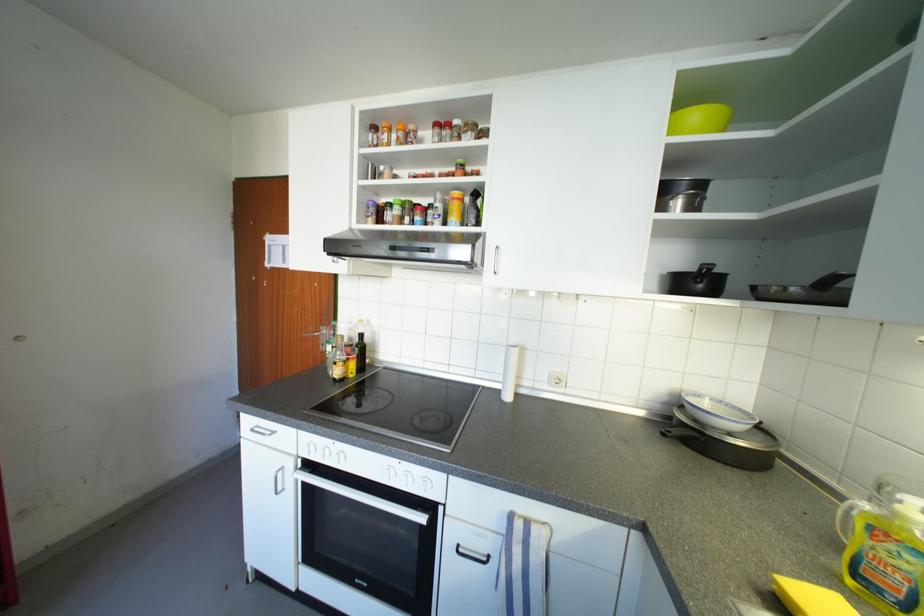
Describe the element at coordinates (277, 480) in the screenshot. I see `the black cabinet handle` at that location.